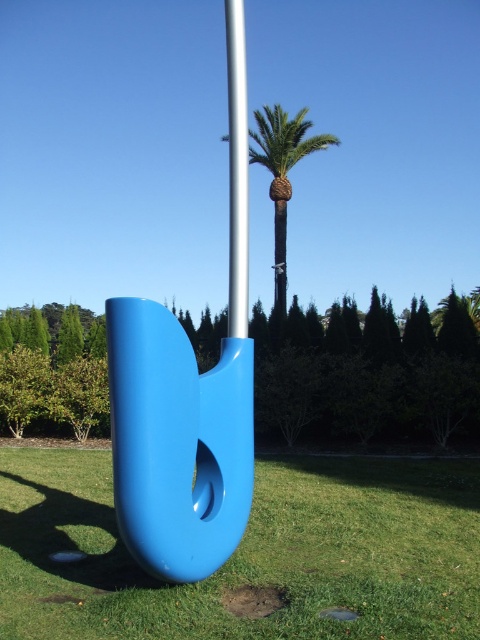
Locate an element on the screen. glossy plastic sculpture at center is located at coordinates (178, 442).

At what (x,y) coordinates should I click in order to perform the action: click on glossy plastic sculpture at center. Please return your answer as a coordinate pair (x, y). The height and width of the screenshot is (640, 480). Looking at the image, I should click on point(178,442).

This screenshot has height=640, width=480. Find the location of `glossy plastic sculpture at center`. glossy plastic sculpture at center is located at coordinates (178, 442).

Is green grass at lower center thinner than green leafy palm at center?

Incorrect, green grass at lower center's width is not less than green leafy palm at center's.

Find the location of `green grass at lower center`. green grass at lower center is located at coordinates (249, 554).

Locate an element on the screen. This screenshot has height=640, width=480. green grass at lower center is located at coordinates (249, 554).

Can you confirm if green leafy tree at center is smaller than silver metallic pole at center?

No, green leafy tree at center is not smaller than silver metallic pole at center.

Does green leafy tree at center have a lesser width compared to silver metallic pole at center?

No.

Is point (476, 353) behind point (232, 51)?

Yes, point (476, 353) is farther from viewer.

The height and width of the screenshot is (640, 480). Find the location of `green leafy tree at center`. green leafy tree at center is located at coordinates (368, 376).